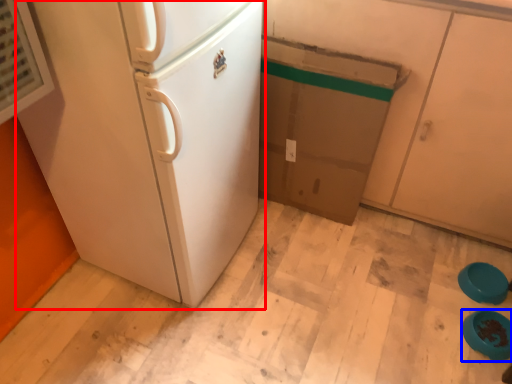
Question: Among these objects, which one is nearest to the camera, refrigerator (highlighted by a red box) or appliance (highlighted by a blue box)?

Choices:
 (A) refrigerator
 (B) appliance

Answer: (A)